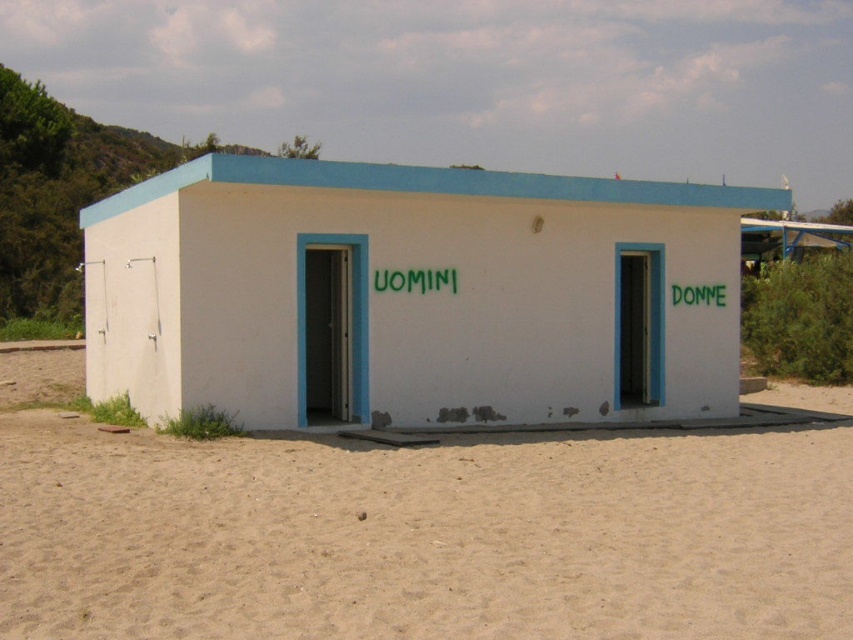
Is the position of beige sand at lower center less distant than that of white matte building at center?

Yes, beige sand at lower center is in front of white matte building at center.

Is beige sand at lower center smaller than white matte building at center?

Indeed, beige sand at lower center has a smaller size compared to white matte building at center.

Which is in front, point (158, 458) or point (531, 248)?

Point (158, 458) is more forward.

The width and height of the screenshot is (853, 640). What are the coordinates of `beige sand at lower center` in the screenshot? It's located at (415, 531).